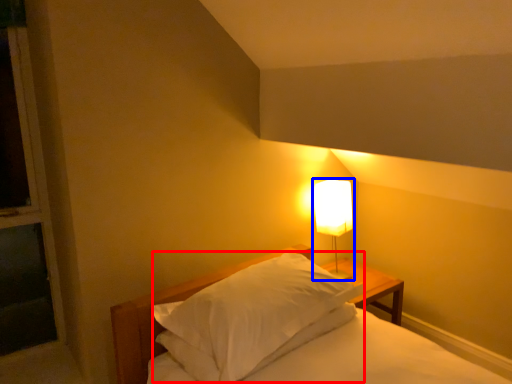
Question: Which of the following is the closest to the observer, pillow (highlighted by a red box) or lamp (highlighted by a blue box)?

Choices:
 (A) pillow
 (B) lamp

Answer: (A)